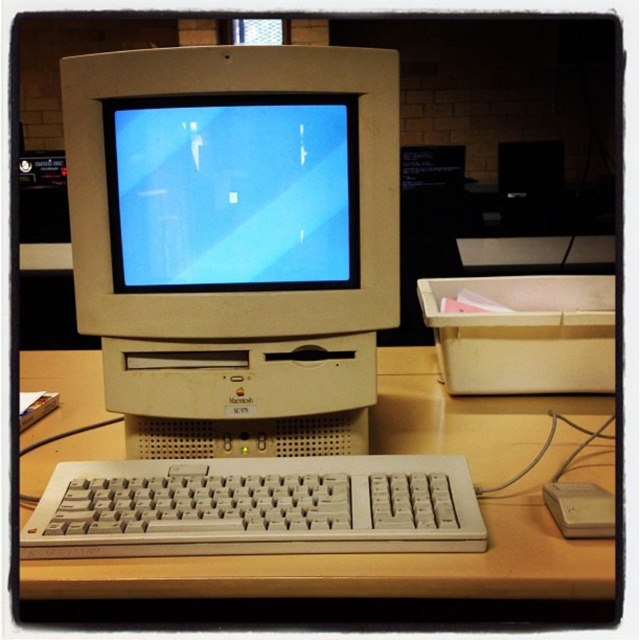
You are setting up a desk organizer that requires knowing the height of each object. Which object is taller between the matte plastic monitor at center and the beige plastic mouse at lower right?

The matte plastic monitor at center is taller than the beige plastic mouse at lower right according to the description.

You are sitting at the desk in front of the vintage Apple Macintosh LC 575 setup. You want to reach the beige plastic keyboard at lower center without moving the matte plastic monitor at center. Is this possible given their positions?

The beige plastic keyboard at lower center is behind the matte plastic monitor at center, so you can reach it without moving the monitor by accessing it from the back side of the desk setup.

From the picture: You are sitting at the desk and want to reach the beige plastic keyboard at lower center. Is the beige plastic monitor at center blocking your access to it?

The beige plastic monitor at center is positioned over the beige plastic keyboard at lower center, so it is blocking access to the keyboard.